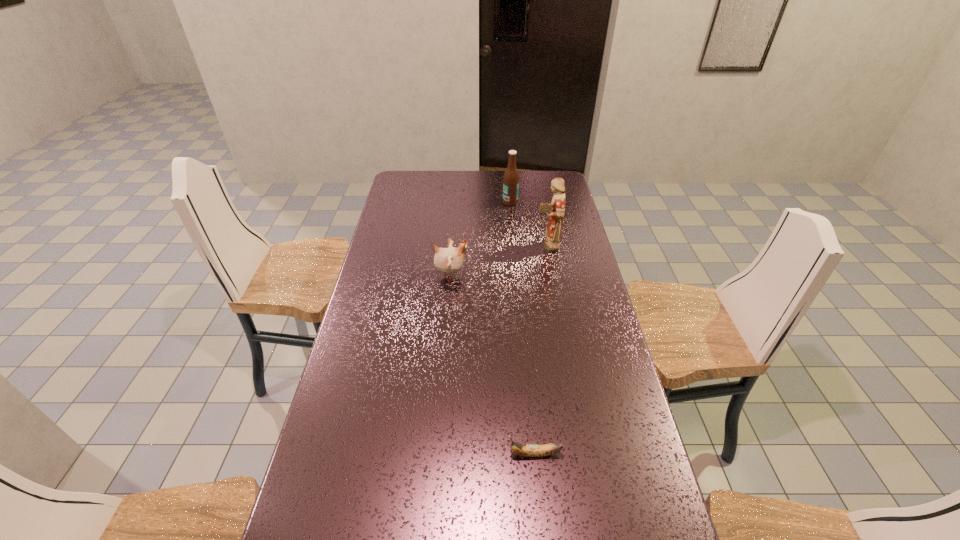
Locate an element on the screen. free space at the far left corner is located at coordinates (418, 177).

At what (x,y) coordinates should I click in order to perform the action: click on vacant area that lies between the shortest object and the beer bottle. Please return your answer as a coordinate pair (x, y). Image resolution: width=960 pixels, height=540 pixels. Looking at the image, I should click on (522, 328).

What are the coordinates of `free space between the rightmost object and the shortest object` in the screenshot? It's located at (540, 349).

This screenshot has height=540, width=960. Identify the location of empty space between the tallest object and the bird. (499, 260).

This screenshot has height=540, width=960. I want to click on free space between the bird and the third nearest object, so click(x=499, y=260).

Find the location of `vacant area that lies between the nearest object and the second tallest object`. vacant area that lies between the nearest object and the second tallest object is located at coordinates (522, 328).

Identify the location of free space between the second tallest object and the figurine. (529, 224).

Where is `vacant space that's between the nearest object and the tallest object`? This screenshot has width=960, height=540. vacant space that's between the nearest object and the tallest object is located at coordinates (540, 349).

Identify the location of vacant area that lies between the rightmost object and the leftmost object. (499, 260).

Locate an element on the screen. This screenshot has height=540, width=960. vacant area that lies between the third farthest object and the shortest object is located at coordinates (492, 364).